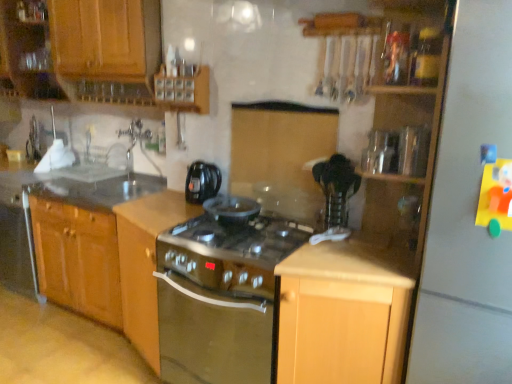
Question: Is white matte refrigerator at right wider than satin silver oven at center?

Choices:
 (A) yes
 (B) no

Answer: (A)

Question: Is satin silver oven at center surrounded by white matte refrigerator at right?

Choices:
 (A) yes
 (B) no

Answer: (B)

Question: Is white matte refrigerator at right further to camera compared to satin silver oven at center?

Choices:
 (A) no
 (B) yes

Answer: (A)

Question: Is white matte refrigerator at right oriented away from satin silver oven at center?

Choices:
 (A) no
 (B) yes

Answer: (A)

Question: Is white matte refrigerator at right bigger than satin silver oven at center?

Choices:
 (A) no
 (B) yes

Answer: (B)

Question: In terms of width, does clear plastic container at upper right, which is the first appliance in front-to-back order, look wider or thinner when compared to satin silver oven at center?

Choices:
 (A) thin
 (B) wide

Answer: (A)

Question: From a real-world perspective, is clear plastic container at upper right, which is the first appliance in front-to-back order, positioned above or below satin silver oven at center?

Choices:
 (A) below
 (B) above

Answer: (B)

Question: Relative to satin silver oven at center, is clear plastic container at upper right, which is the second appliance in back-to-front order, in front or behind?

Choices:
 (A) behind
 (B) front

Answer: (B)

Question: From the image's perspective, relative to satin silver oven at center, is clear plastic container at upper right, which is the first appliance in front-to-back order, above or below?

Choices:
 (A) above
 (B) below

Answer: (A)

Question: Is point (377, 173) closer or farther from the camera than point (343, 248)?

Choices:
 (A) closer
 (B) farther

Answer: (B)

Question: Looking at their shapes, would you say metallic silver toaster at upper right, the first appliance viewed from the back, is wider or thinner than light wood cabinet at center, the first cabinetry in the right-to-left sequence?

Choices:
 (A) thin
 (B) wide

Answer: (A)

Question: From the image's perspective, is metallic silver toaster at upper right, the first appliance viewed from the back, above or below light wood cabinet at center, the 4th cabinetry when ordered from left to right?

Choices:
 (A) above
 (B) below

Answer: (A)

Question: Is metallic silver toaster at upper right, the first appliance viewed from the back, spatially inside light wood cabinet at center, the 4th cabinetry when ordered from left to right, or outside of it?

Choices:
 (A) outside
 (B) inside

Answer: (A)

Question: Looking at the image, does satin wood stove at center, which ranks as the 3th cabinetry in right-to-left order, seem bigger or smaller compared to wooden cabinet at upper left, which is the fourth cabinetry in right-to-left order?

Choices:
 (A) big
 (B) small

Answer: (B)

Question: In terms of width, does satin wood stove at center, which appears as the second cabinetry when viewed from the left, look wider or thinner when compared to wooden cabinet at upper left, which is the fourth cabinetry in right-to-left order?

Choices:
 (A) thin
 (B) wide

Answer: (B)